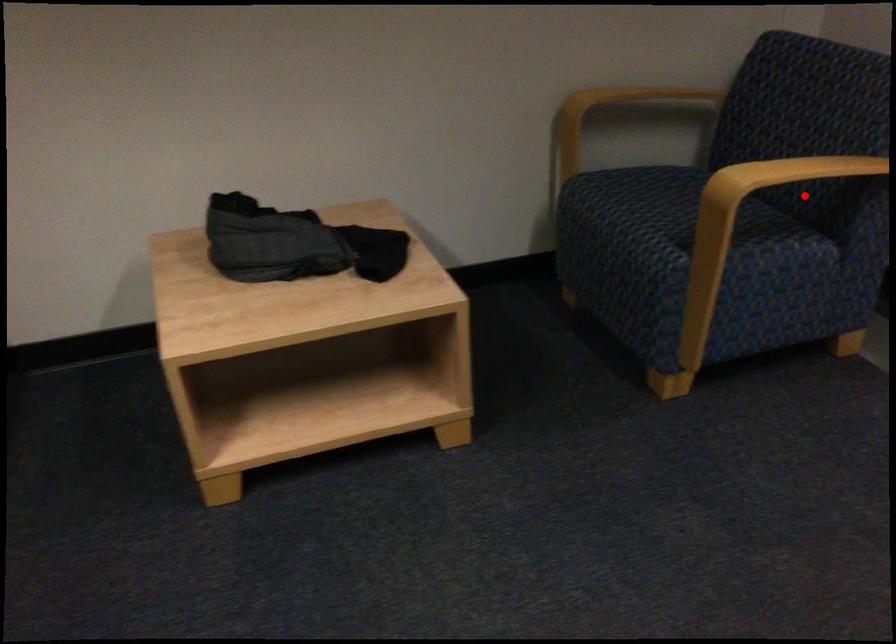
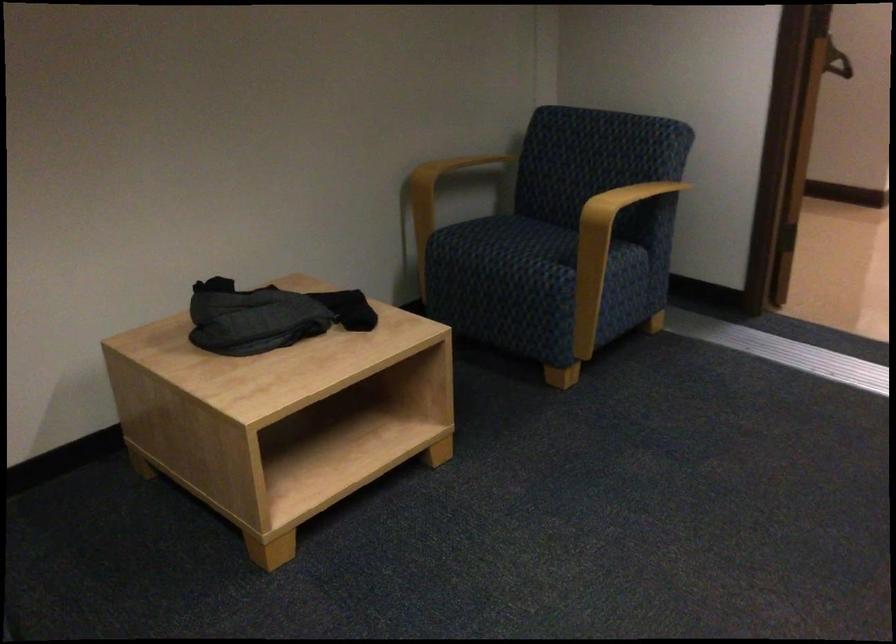
Locate, in the second image, the point that corresponds to the highlighted location in the first image.

(612, 218)